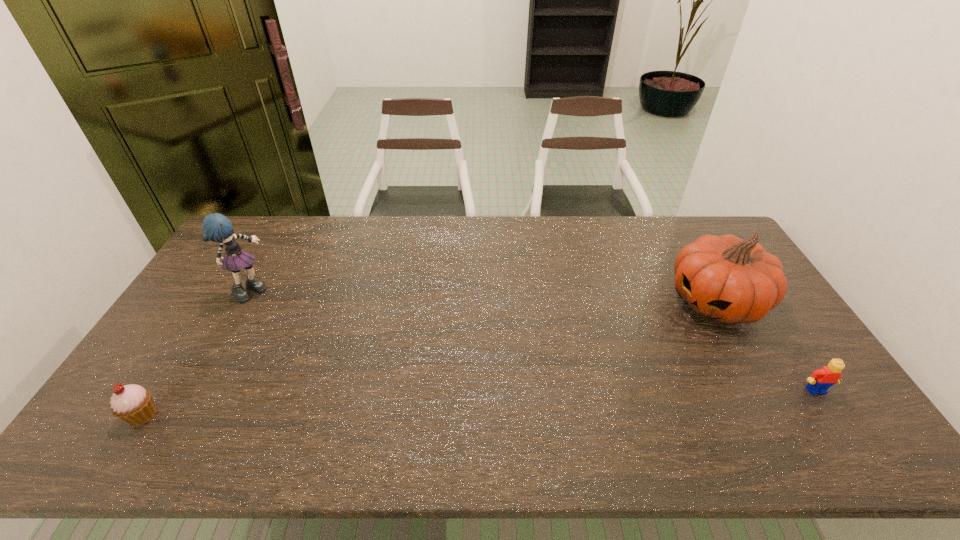
Where is `free space on the desktop that is between the leftmost object and the Lego and is positioned on the face of the pumpkin`? This screenshot has width=960, height=540. free space on the desktop that is between the leftmost object and the Lego and is positioned on the face of the pumpkin is located at coordinates (586, 399).

This screenshot has height=540, width=960. I want to click on free space on the desktop that is between the nearest object and the Lego and is positioned on the front-facing side of the third object from right to left, so click(x=490, y=402).